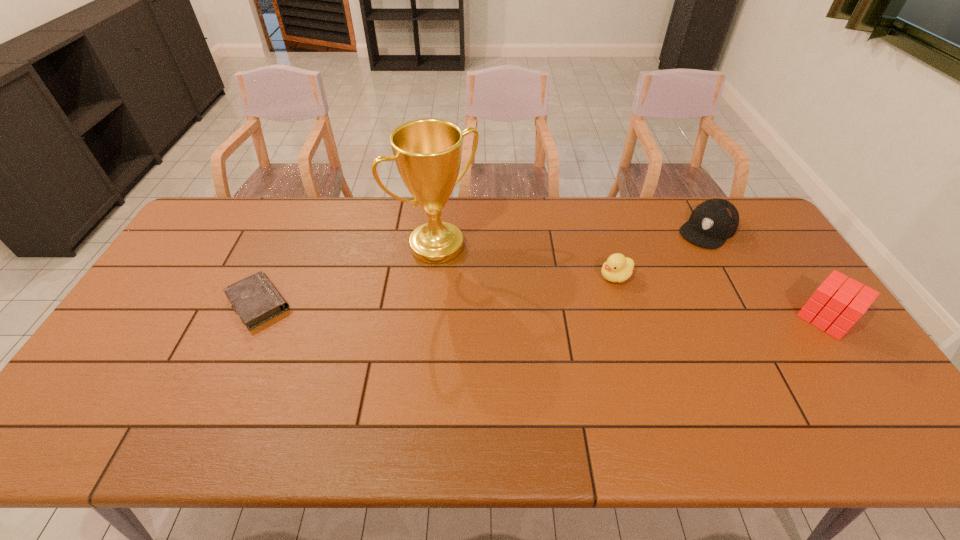
What are the coordinates of `free space on the desktop that is between the leftmost object and the cube and is positioned on the front-facing side of the second object from right to left` in the screenshot? It's located at (614, 312).

Find the location of a particular element. This screenshot has height=540, width=960. vacant spot on the desktop that is between the diary and the rightmost object and is positioned by the handles of the tallest object is located at coordinates (494, 309).

Find the location of a particular element. The image size is (960, 540). free space on the desktop that is between the diary and the cube and is positioned on the beak of the duckling is located at coordinates (543, 310).